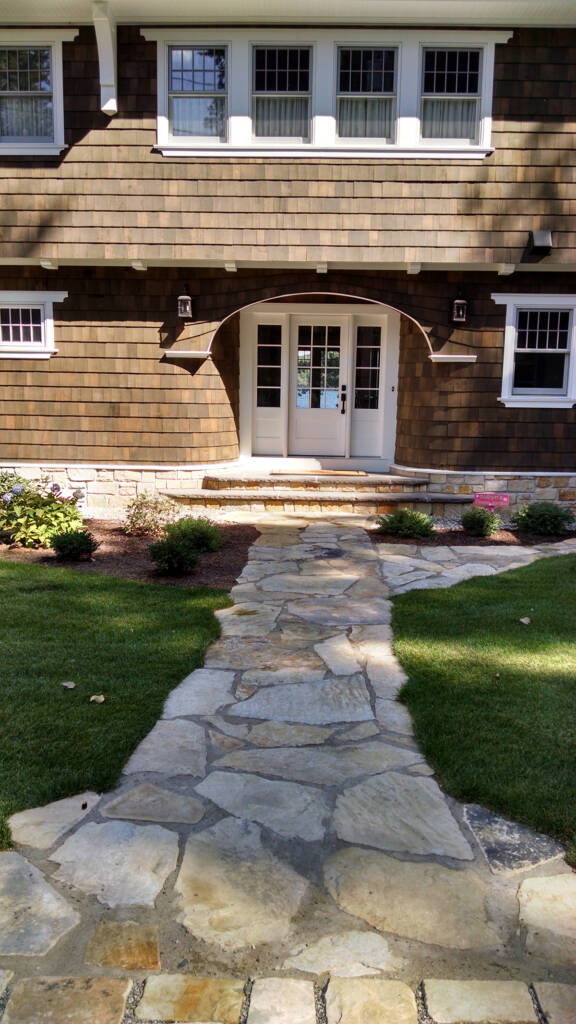
Locate an element on the screen. The image size is (576, 1024). door handle is located at coordinates (343, 398).